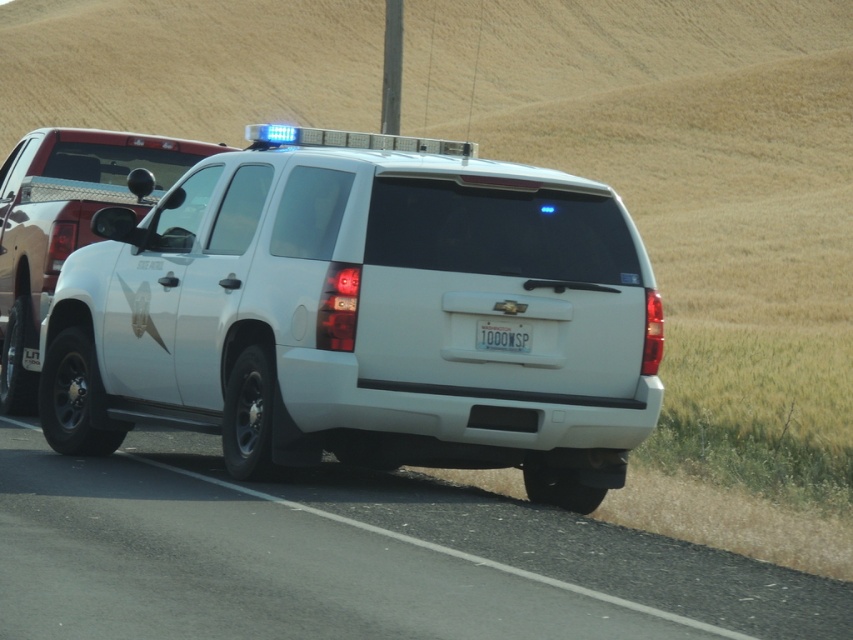
Question: Which point is closer to the camera taking this photo?

Choices:
 (A) (18, 458)
 (B) (643, 308)
 (C) (502, 342)
 (D) (15, 292)

Answer: (C)

Question: Which of the following is the closest to the observer?

Choices:
 (A) white rubber highway at center
 (B) white glossy suv at center
 (C) white plastic license plate at center
 (D) white matte suv at center

Answer: (A)

Question: Is white matte suv at center wider than white glossy suv at center?

Choices:
 (A) yes
 (B) no

Answer: (B)

Question: Is white rubber highway at center further to camera compared to white plastic license plate at center?

Choices:
 (A) no
 (B) yes

Answer: (A)

Question: Does white glossy suv at center appear under white plastic license plate at center?

Choices:
 (A) no
 (B) yes

Answer: (A)

Question: Among these points, which one is farthest from the camera?

Choices:
 (A) (24, 356)
 (B) (601, 417)
 (C) (671, 612)

Answer: (A)